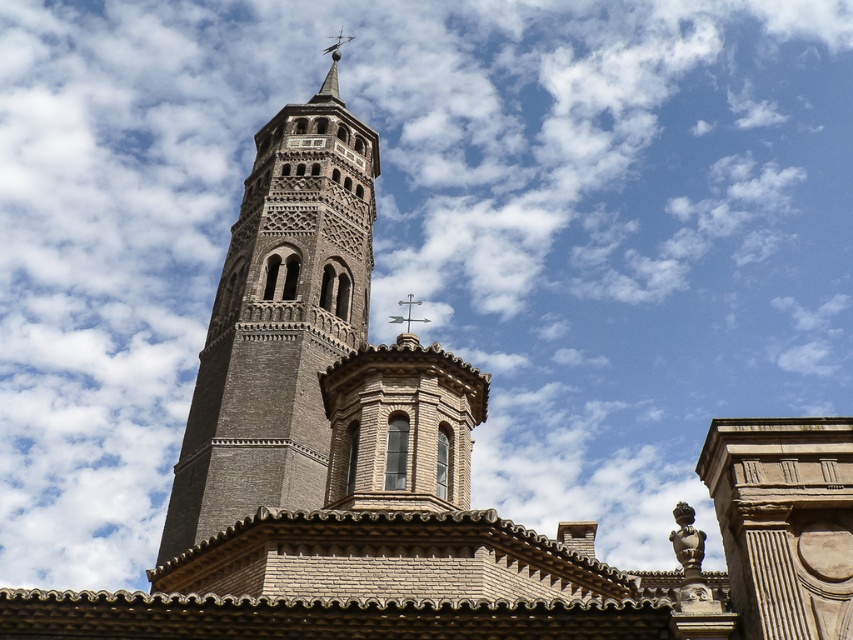
Is brown textured stone bell tower at center closer to camera compared to polished silver spire at upper center?

Yes, brown textured stone bell tower at center is closer to the viewer.

What do you see at coordinates (277, 323) in the screenshot? I see `brown textured stone bell tower at center` at bounding box center [277, 323].

Locate an element on the screen. The image size is (853, 640). brown textured stone bell tower at center is located at coordinates (277, 323).